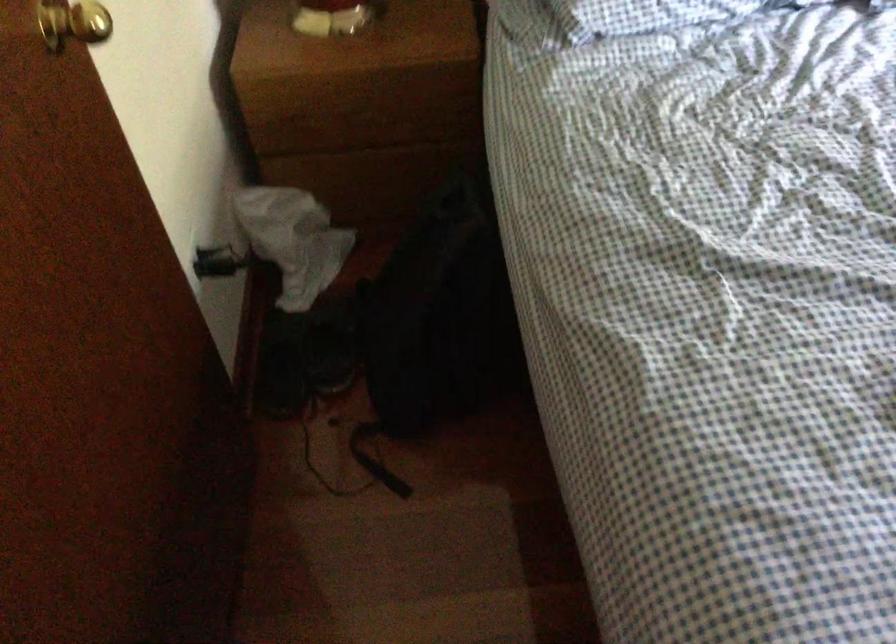
Find where to pull the gold door knob. Please return your answer as a coordinate pair (x, y).

(73, 23)